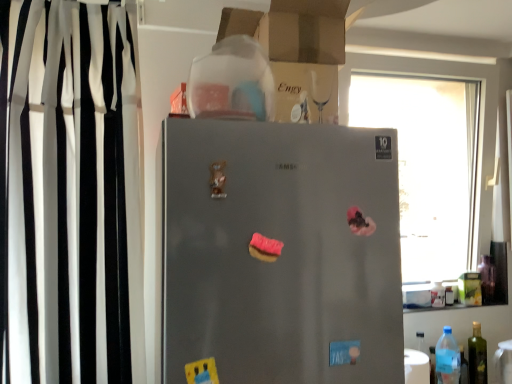
Question: Is transparent plastic bottle at right, which is the second bottle in right-to-left order, far from satin silver fridge at center?

Choices:
 (A) yes
 (B) no

Answer: (A)

Question: Is transparent plastic bottle at right, placed as the 2th bottle when sorted from left to right, directly adjacent to satin silver fridge at center?

Choices:
 (A) no
 (B) yes

Answer: (A)

Question: Considering the relative sizes of transparent plastic bottle at right, which is counted as the 1th bottle, starting from the back, and satin silver fridge at center in the image provided, is transparent plastic bottle at right, which is counted as the 1th bottle, starting from the back, smaller than satin silver fridge at center?

Choices:
 (A) no
 (B) yes

Answer: (B)

Question: From the image's perspective, is transparent plastic bottle at right, which is the second bottle in right-to-left order, located above satin silver fridge at center?

Choices:
 (A) yes
 (B) no

Answer: (B)

Question: Is satin silver fridge at center surrounded by transparent plastic bottle at right, which is the third bottle in front-to-back order?

Choices:
 (A) no
 (B) yes

Answer: (A)

Question: From the image's perspective, relative to pink glossy donut at center, is transparent glass window at upper right above or below?

Choices:
 (A) below
 (B) above

Answer: (B)

Question: Is point (449, 274) closer or farther from the camera than point (256, 253)?

Choices:
 (A) farther
 (B) closer

Answer: (A)

Question: In the image, is transparent glass window at upper right positioned in front of or behind pink glossy donut at center?

Choices:
 (A) behind
 (B) front

Answer: (A)

Question: Looking at their shapes, would you say transparent glass window at upper right is wider or thinner than pink glossy donut at center?

Choices:
 (A) thin
 (B) wide

Answer: (B)

Question: In the image, is pink glossy donut at center positioned in front of or behind blue translucent bottle at lower right, the 3th bottle from the back?

Choices:
 (A) front
 (B) behind

Answer: (A)

Question: From the image's perspective, is pink glossy donut at center located above or below blue translucent bottle at lower right, placed as the 3th bottle when sorted from right to left?

Choices:
 (A) above
 (B) below

Answer: (A)

Question: Considering the positions of point (266, 248) and point (445, 367), is point (266, 248) closer or farther from the camera than point (445, 367)?

Choices:
 (A) farther
 (B) closer

Answer: (B)

Question: In terms of width, does pink glossy donut at center look wider or thinner when compared to blue translucent bottle at lower right, placed as the 3th bottle when sorted from right to left?

Choices:
 (A) wide
 (B) thin

Answer: (B)

Question: Considering the positions of pink glossy donut at center and transparent glass window at upper right in the image, is pink glossy donut at center wider or thinner than transparent glass window at upper right?

Choices:
 (A) thin
 (B) wide

Answer: (A)

Question: Relative to transparent glass window at upper right, is pink glossy donut at center in front or behind?

Choices:
 (A) front
 (B) behind

Answer: (A)